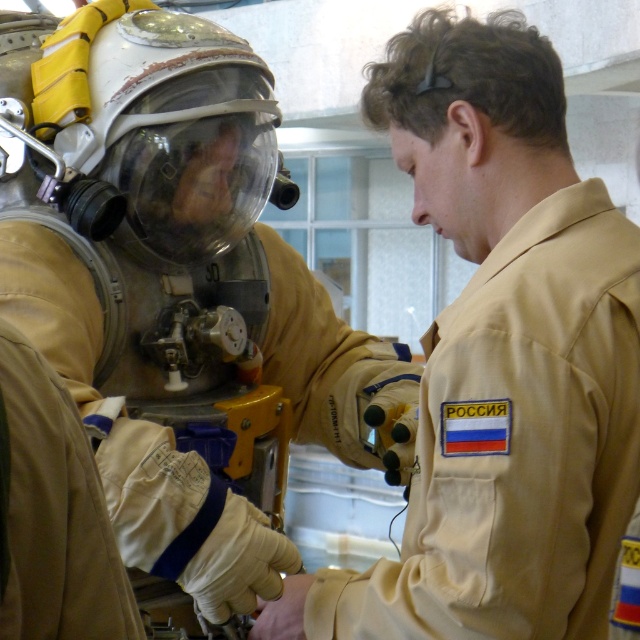
Which is in front, point (246, 580) or point (522, 168)?

Point (522, 168) is more forward.

Who is more forward, (141, 56) or (509, 97)?

Positioned in front is point (509, 97).

Locate an element on the screen. The height and width of the screenshot is (640, 640). beige fabric uniform at center is located at coordinates (179, 294).